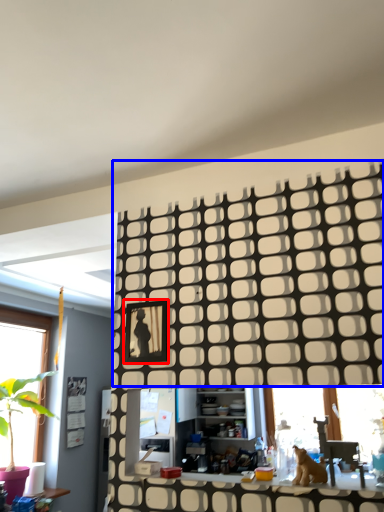
Question: Which object is closer to the camera taking this photo, picture frame (highlighted by a red box) or pattern (highlighted by a blue box)?

Choices:
 (A) picture frame
 (B) pattern

Answer: (B)